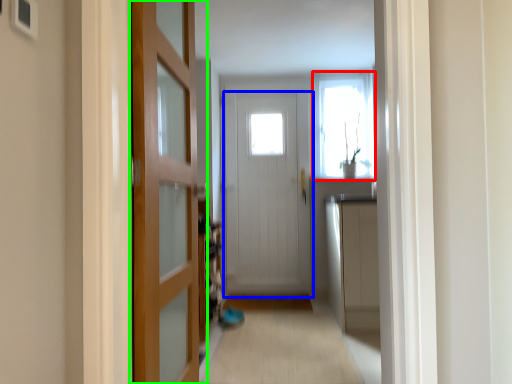
Question: Which is farther away from window (highlighted by a red box)? door (highlighted by a blue box) or door (highlighted by a green box)?

Choices:
 (A) door
 (B) door

Answer: (B)